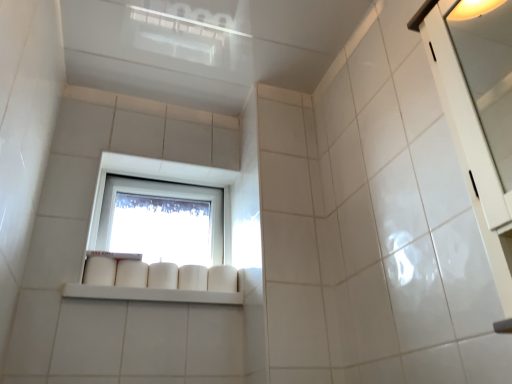
Question: Considering the positions of white glossy shelf at center and white glossy cabinet at right in the image, is white glossy shelf at center taller or shorter than white glossy cabinet at right?

Choices:
 (A) short
 (B) tall

Answer: (A)

Question: Is white glossy shelf at center to the left or to the right of white glossy cabinet at right in the image?

Choices:
 (A) right
 (B) left

Answer: (B)

Question: Estimate the real-world distances between objects in this image. Which object is closer to the transparent glass window at center?

Choices:
 (A) white glossy shelf at center
 (B) white glossy cabinet at right

Answer: (A)

Question: Which is nearer to the white glossy cabinet at right?

Choices:
 (A) transparent glass window at center
 (B) white glossy shelf at center

Answer: (B)